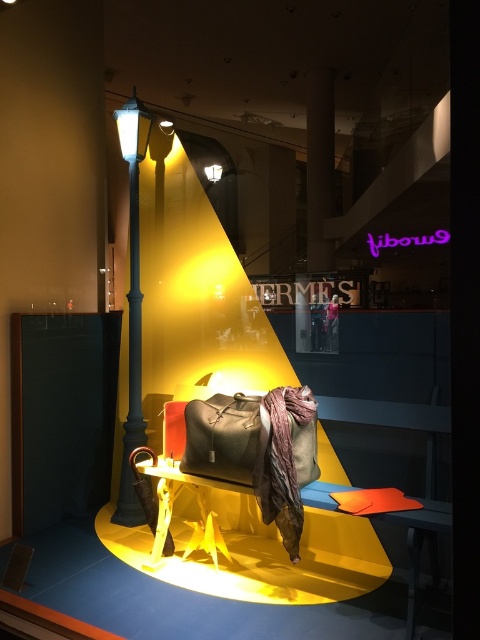
Question: Can you confirm if smooth concrete pillar at center is positioned below matte black lamp post at upper center?

Choices:
 (A) no
 (B) yes

Answer: (B)

Question: Does leather bag at center appear under matte black lamp post at upper center?

Choices:
 (A) yes
 (B) no

Answer: (A)

Question: Based on their relative distances, which object is farther from the matte black lamp post at upper center?

Choices:
 (A) leather bag at center
 (B) metallic blue lamp post at left

Answer: (A)

Question: Which of the following is the closest to the observer?

Choices:
 (A) leather bag at center
 (B) smooth concrete pillar at center
 (C) matte black lamp post at upper center
 (D) metallic blue lamp post at left

Answer: (A)

Question: Does smooth concrete pillar at center appear under matte black lamp post at upper center?

Choices:
 (A) yes
 (B) no

Answer: (A)

Question: Which point appears farthest from the camera in this image?

Choices:
 (A) (213, 180)
 (B) (262, 435)

Answer: (A)